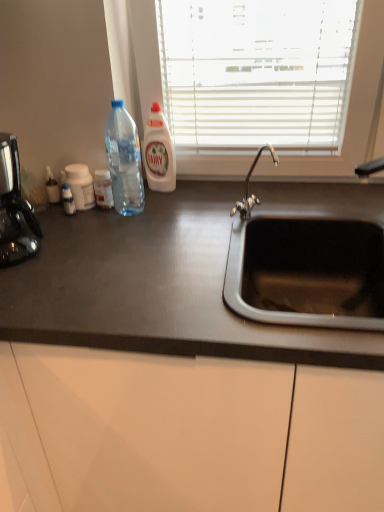
The height and width of the screenshot is (512, 384). What are the coordinates of `vacant area on top of black matte countertop at center (from a real-world perspective)` in the screenshot? It's located at (208, 230).